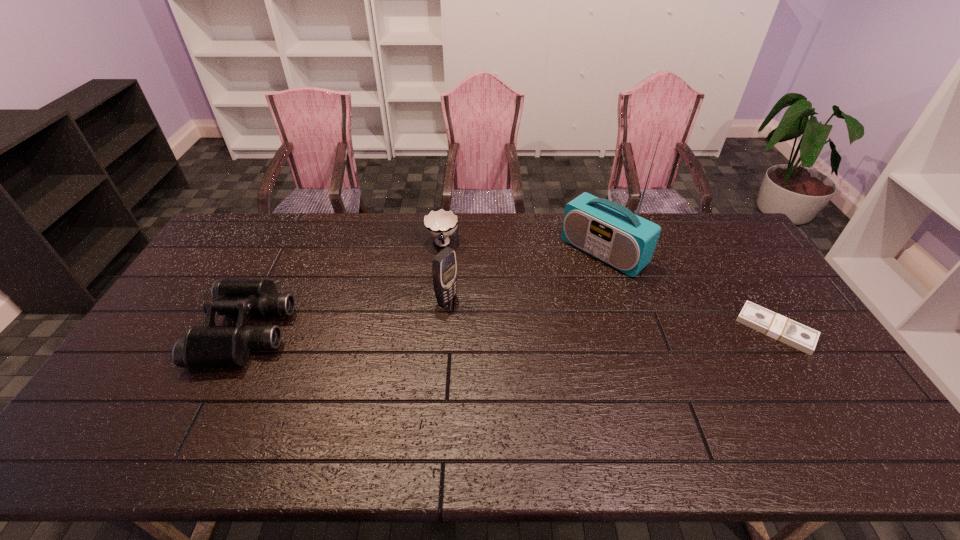
Where is `vacant space located on the left of the rightmost object`? This screenshot has width=960, height=540. vacant space located on the left of the rightmost object is located at coordinates (682, 329).

This screenshot has height=540, width=960. I want to click on free space located on the front panel of the fourth object from left to right, so click(x=530, y=313).

Locate an element on the screen. vacant point located on the front panel of the fourth object from left to right is located at coordinates (512, 327).

This screenshot has height=540, width=960. Find the location of `free space located 0.360m on the front panel of the fourth object from left to right`. free space located 0.360m on the front panel of the fourth object from left to right is located at coordinates (508, 331).

Where is `free space located 0.270m on the front face of the cellular telephone`? This screenshot has height=540, width=960. free space located 0.270m on the front face of the cellular telephone is located at coordinates (532, 345).

Where is `vacant space located 0.070m on the front face of the cellular telephone`? The height and width of the screenshot is (540, 960). vacant space located 0.070m on the front face of the cellular telephone is located at coordinates (474, 314).

You are a GUI agent. You are given a task and a screenshot of the screen. Output one action in this format:
    pyautogui.click(x=<x>, y=<y>)
    Task: Click on the free spot located 0.050m on the front face of the cellular telephone
    This screenshot has height=540, width=960.
    Given the screenshot: What is the action you would take?
    pyautogui.click(x=468, y=312)

Find the location of `vacant space positioned on the side of the cup with the handle`. vacant space positioned on the side of the cup with the handle is located at coordinates 446,282.

This screenshot has width=960, height=540. Find the location of `vacant space located on the side of the cup with the handle`. vacant space located on the side of the cup with the handle is located at coordinates (447, 284).

Find the location of a particular element. vacant space located 0.270m on the side of the cup with the handle is located at coordinates coord(451,316).